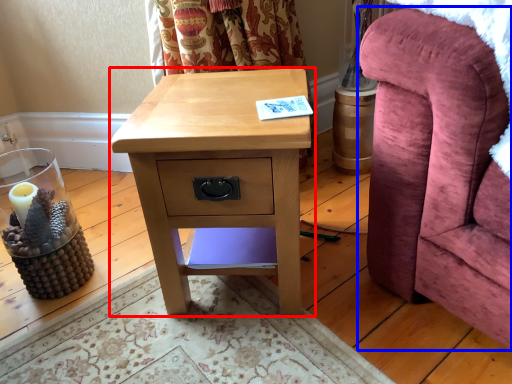
Question: Which of the following is the closest to the observer, nightstand (highlighted by a red box) or furniture (highlighted by a blue box)?

Choices:
 (A) nightstand
 (B) furniture

Answer: (B)